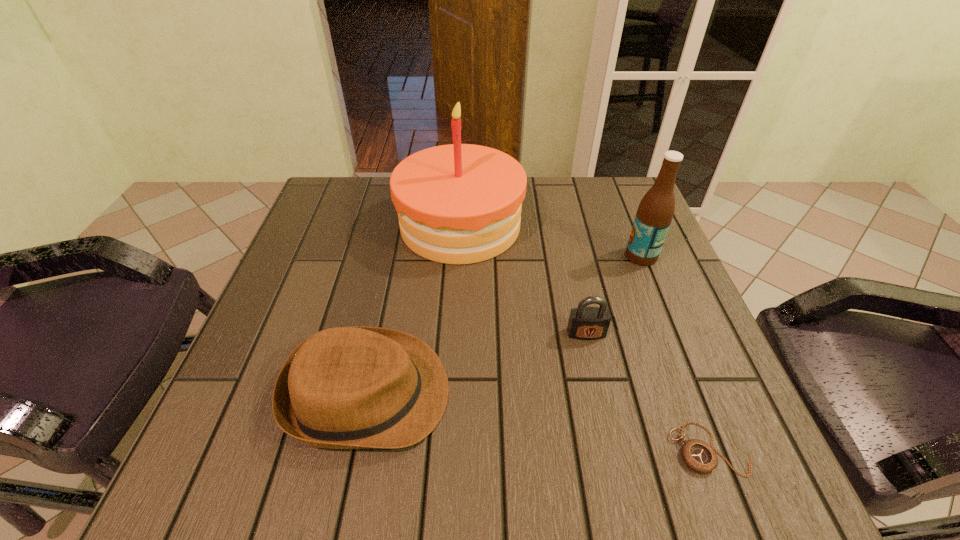
The width and height of the screenshot is (960, 540). In order to click on vacant region that satisfies the following two spatial constraints: 1. on the front of the pocket watch near the keyhole; 2. on the left side of the third object from left to right in this screenshot , I will do `click(612, 449)`.

You are a GUI agent. You are given a task and a screenshot of the screen. Output one action in this format:
    pyautogui.click(x=<x>, y=<y>)
    Task: Click on the free space that satisfies the following two spatial constraints: 1. on the front-facing side of the pocket watch; 2. on the right side of the fedora
    The image size is (960, 540).
    Given the screenshot: What is the action you would take?
    pyautogui.click(x=356, y=449)

Where is `vacant point that satisfies the following two spatial constraints: 1. on the back side of the pocket watch; 2. on the front-facing side of the fedora`? This screenshot has width=960, height=540. vacant point that satisfies the following two spatial constraints: 1. on the back side of the pocket watch; 2. on the front-facing side of the fedora is located at coordinates (688, 393).

Where is `free point that satisfies the following two spatial constraints: 1. on the front-facing side of the fedora; 2. on the left side of the shortest object`? free point that satisfies the following two spatial constraints: 1. on the front-facing side of the fedora; 2. on the left side of the shortest object is located at coordinates pyautogui.click(x=356, y=449).

Where is `free space that satisfies the following two spatial constraints: 1. on the front-facing side of the fedora; 2. on the right side of the shortest object`? This screenshot has width=960, height=540. free space that satisfies the following two spatial constraints: 1. on the front-facing side of the fedora; 2. on the right side of the shortest object is located at coordinates (356, 449).